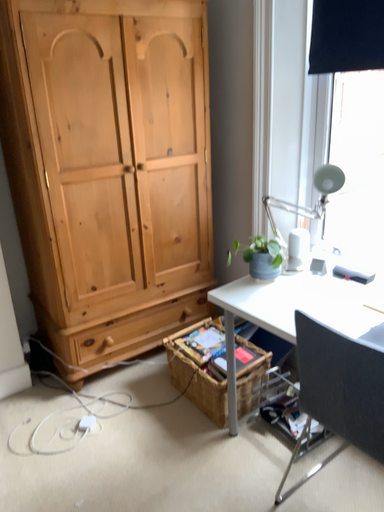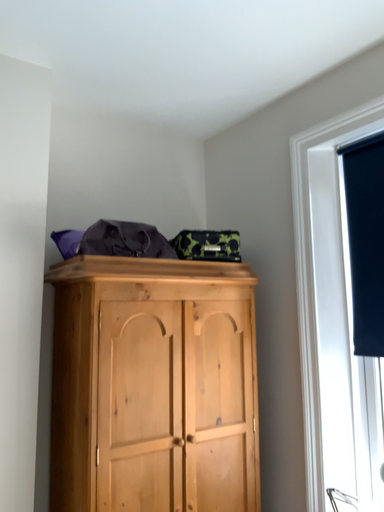
Question: Which way did the camera rotate in the video?

Choices:
 (A) rotated upward
 (B) rotated downward

Answer: (A)